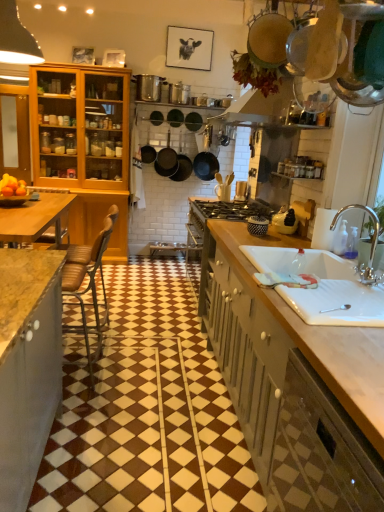
Locate an element on the screen. This screenshot has width=384, height=512. green matte cabinet at lower right, positioned as the first cabinetry in bottom-to-top order is located at coordinates (321, 451).

The width and height of the screenshot is (384, 512). What do you see at coordinates (321, 451) in the screenshot?
I see `green matte cabinet at lower right, which ranks as the third cabinetry in back-to-front order` at bounding box center [321, 451].

This screenshot has width=384, height=512. What do you see at coordinates (371, 244) in the screenshot?
I see `silver metallic faucet at sink right` at bounding box center [371, 244].

In order to click on brown leather chair at left in this screenshot , I will do click(x=88, y=275).

What is the approximate width of matte black frying pan at center?

It is 20.00 centimeters.

You are a GUI agent. You are given a task and a screenshot of the screen. Output one action in this format:
    pyautogui.click(x=<x>, y=<y>)
    Task: Click on the white ceramic sink at lower right
    The image size is (384, 512).
    Given the screenshot: What is the action you would take?
    pyautogui.click(x=322, y=286)

Is point (287, 446) in front of point (365, 272)?

Yes, it is in front of point (365, 272).

Consider the image. Looking at their sizes, would you say green matte cabinet at lower right, which ranks as the third cabinetry in back-to-front order, is wider or thinner than silver metallic faucet at sink right?

green matte cabinet at lower right, which ranks as the third cabinetry in back-to-front order, is wider than silver metallic faucet at sink right.

The height and width of the screenshot is (512, 384). In order to click on tap above the green matte cabinet at lower right, which appears as the first cabinetry when viewed from the right (from a real-world perspective) in this screenshot , I will do `click(371, 244)`.

Does green matte cabinet at lower right, placed as the first cabinetry when sorted from front to back, appear on the right side of silver metallic faucet at sink right?

No, green matte cabinet at lower right, placed as the first cabinetry when sorted from front to back, is not to the right of silver metallic faucet at sink right.

Would you say brown leather chair at left is part of matte wooden cabinet at left, the first cabinetry viewed from the top,'s contents?

Actually, brown leather chair at left is outside matte wooden cabinet at left, the first cabinetry viewed from the top.

Is matte wooden cabinet at left, the third cabinetry ordered from the bottom, facing away from brown leather chair at left?

No, brown leather chair at left is not at the back of matte wooden cabinet at left, the third cabinetry ordered from the bottom.

Considering the positions of objects matte wooden cabinet at left, which appears as the 3th cabinetry when viewed from the right, and brown leather chair at left in the image provided, who is more to the left, matte wooden cabinet at left, which appears as the 3th cabinetry when viewed from the right, or brown leather chair at left?

From the viewer's perspective, matte wooden cabinet at left, which appears as the 3th cabinetry when viewed from the right, appears more on the left side.

How different are the orientations of matte wooden cabinet at left, the 3th cabinetry from the front, and brown leather chair at left in degrees?

91.4 degrees separate the facing orientations of matte wooden cabinet at left, the 3th cabinetry from the front, and brown leather chair at left.

From the image's perspective, starting from the white ceramic sink at lower right, which cabinetry is the 1st one below? Please provide its 2D coordinates.

[(289, 377)]

Is white ceramic sink at lower right not close to wooden countertop at right, positioned as the second cabinetry in front-to-back order?

No, white ceramic sink at lower right is not far away from wooden countertop at right, positioned as the second cabinetry in front-to-back order.

Which point is more distant from viewer, (x=305, y=304) or (x=234, y=266)?

The point (x=234, y=266) is farther.

From a real-world perspective, which is physically below, white ceramic sink at lower right or wooden countertop at right, marked as the second cabinetry in a bottom-to-top arrangement?

wooden countertop at right, marked as the second cabinetry in a bottom-to-top arrangement, from a real-world perspective.

Looking at this image, which object is further away from the camera, silver metallic faucet at sink right or matte wooden cabinet at left, the 3th cabinetry from the front?

Positioned behind is matte wooden cabinet at left, the 3th cabinetry from the front.

Which is correct: silver metallic faucet at sink right is inside matte wooden cabinet at left, the third cabinetry ordered from the bottom, or outside of it?

silver metallic faucet at sink right exists outside the volume of matte wooden cabinet at left, the third cabinetry ordered from the bottom.

Which is farther, (373,234) or (19,152)?

The point (19,152) is more distant.

Which of these two, matte black frying pan at center or silver metallic faucet at sink right, stands taller?

matte black frying pan at center is taller.

From a real-world perspective, is matte black frying pan at center positioned above or below silver metallic faucet at sink right?

matte black frying pan at center is above silver metallic faucet at sink right.

Does matte black frying pan at center have a lesser width compared to silver metallic faucet at sink right?

Incorrect, the width of matte black frying pan at center is not less than that of silver metallic faucet at sink right.

Locate an element on the screen. The height and width of the screenshot is (512, 384). kitchen appliance on the left of silver metallic faucet at sink right is located at coordinates (206, 158).

From the image's perspective, is matte black frying pan at center on white ceramic sink at lower right?

Yes, from the image's perspective, matte black frying pan at center is on top of white ceramic sink at lower right.

Considering the positions of objects matte black frying pan at center and white ceramic sink at lower right in the image provided, who is more to the left, matte black frying pan at center or white ceramic sink at lower right?

matte black frying pan at center is more to the left.

Is matte black frying pan at center further to the viewer compared to white ceramic sink at lower right?

Yes, it is.

Can you confirm if matte wooden cabinet at left, which is the first cabinetry in back-to-front order, is wider than wooden countertop at right, the 2th cabinetry from the left?

In fact, matte wooden cabinet at left, which is the first cabinetry in back-to-front order, might be narrower than wooden countertop at right, the 2th cabinetry from the left.

Is matte wooden cabinet at left, which appears as the 1th cabinetry when viewed from the left, positioned beyond the bounds of wooden countertop at right, which is the 2th cabinetry from top to bottom?

Yes, matte wooden cabinet at left, which appears as the 1th cabinetry when viewed from the left, is located beyond the bounds of wooden countertop at right, which is the 2th cabinetry from top to bottom.

Does point (10, 98) lie in front of point (222, 340)?

No, it is behind (222, 340).

Is matte wooden cabinet at left, which appears as the 1th cabinetry when viewed from the left, beside wooden countertop at right, marked as the second cabinetry in a back-to-front arrangement?

No, matte wooden cabinet at left, which appears as the 1th cabinetry when viewed from the left, is not beside wooden countertop at right, marked as the second cabinetry in a back-to-front arrangement.

This screenshot has width=384, height=512. In order to click on the 2nd cabinetry in front when counting from the silver metallic faucet at sink right in this screenshot , I will do `click(321, 451)`.

The image size is (384, 512). Identify the location of cabinetry above the brown leather chair at left (from the image's perspective). (15, 132).

When comparing their distances from wooden countertop at right, marked as the second cabinetry in a bottom-to-top arrangement, does brown leather chair at left or green matte cabinet at lower right, positioned as the first cabinetry in bottom-to-top order, seem closer?

Among the two, green matte cabinet at lower right, positioned as the first cabinetry in bottom-to-top order, is located nearer to wooden countertop at right, marked as the second cabinetry in a bottom-to-top arrangement.

Which object lies further to the anchor point green matte cabinet at lower right, the 3th cabinetry from the top, matte wooden cabinet at left, which appears as the 1th cabinetry when viewed from the left, or silver metallic faucet at sink right?

matte wooden cabinet at left, which appears as the 1th cabinetry when viewed from the left, lies further to green matte cabinet at lower right, the 3th cabinetry from the top, than the other object.

From the image, which object appears to be nearer to silver metallic faucet at sink right, matte wooden cabinet at left, the 3th cabinetry from the front, or wooden countertop at right, marked as the second cabinetry in a back-to-front arrangement?

The object closer to silver metallic faucet at sink right is wooden countertop at right, marked as the second cabinetry in a back-to-front arrangement.

Consider the image. From the image, which object appears to be nearer to brown leather chair at left, silver metallic faucet at sink right or matte black frying pan at center?

silver metallic faucet at sink right is positioned closer to the anchor brown leather chair at left.

Based on their spatial positions, is white ceramic sink at lower right or matte black frying pan at center further from wooden countertop at right, which is the 2th cabinetry from top to bottom?

matte black frying pan at center lies further to wooden countertop at right, which is the 2th cabinetry from top to bottom, than the other object.

Consider the image. Based on their spatial positions, is wooden countertop at right, the 2th cabinetry from the left, or green matte cabinet at lower right, the third cabinetry in the left-to-right sequence, closer to brown leather chair at left?

The object closer to brown leather chair at left is wooden countertop at right, the 2th cabinetry from the left.

Based on their spatial positions, is matte black frying pan at center or green matte cabinet at lower right, which ranks as the third cabinetry in back-to-front order, further from silver metallic faucet at sink right?

The object further to silver metallic faucet at sink right is matte black frying pan at center.

From the image, which object appears to be nearer to brown leather chair at left, matte black frying pan at center or matte wooden cabinet at left, which is the first cabinetry in back-to-front order?

matte wooden cabinet at left, which is the first cabinetry in back-to-front order, is positioned closer to the anchor brown leather chair at left.

Locate an element on the screen. tap located between white ceramic sink at lower right and matte wooden cabinet at left, the first cabinetry viewed from the top, in the depth direction is located at coordinates (371, 244).

The image size is (384, 512). I want to click on chair between white ceramic sink at lower right and matte black frying pan at center in the front-back direction, so click(88, 275).

You are a GUI agent. You are given a task and a screenshot of the screen. Output one action in this format:
    pyautogui.click(x=<x>, y=<y>)
    Task: Click on the cabinetry between silver metallic faucet at sink right and matte black frying pan at center from front to back
    
    Given the screenshot: What is the action you would take?
    pyautogui.click(x=15, y=132)

Where is `cabinetry positioned between green matte cabinet at lower right, placed as the first cabinetry when sorted from front to back, and silver metallic faucet at sink right from near to far`? This screenshot has width=384, height=512. cabinetry positioned between green matte cabinet at lower right, placed as the first cabinetry when sorted from front to back, and silver metallic faucet at sink right from near to far is located at coordinates (289, 377).